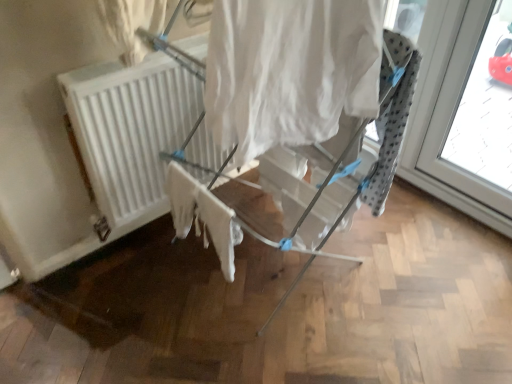
Locate an element on the screen. The image size is (512, 384). vacant space in white fabric curtain at center (from a real-world perspective) is located at coordinates click(x=271, y=344).